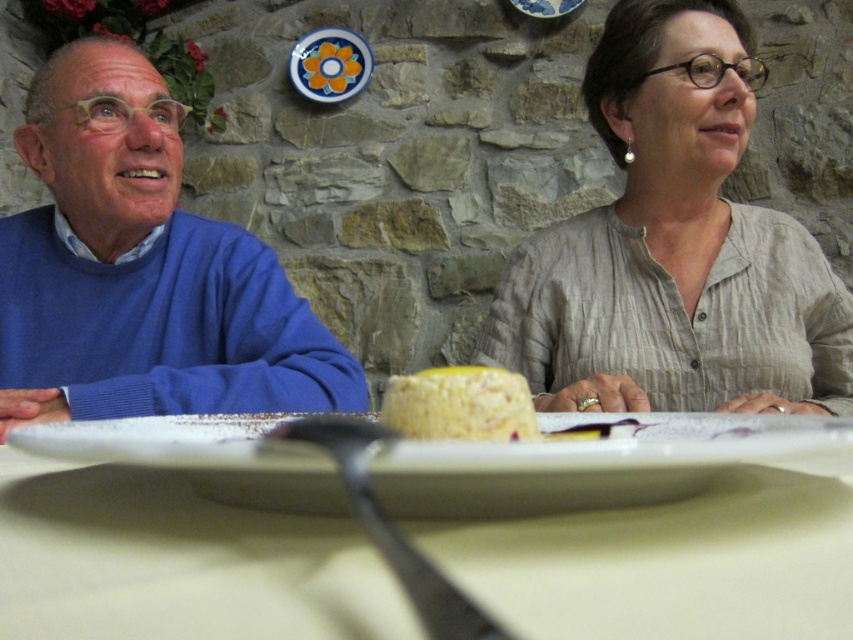
Does white matte plate at center have a smaller size compared to porcelain plate at upper center?

Actually, white matte plate at center might be larger than porcelain plate at upper center.

Who is more forward, (84,579) or (344,33)?

Point (84,579) is in front.

Is point (61, 509) closer to viewer compared to point (294, 54)?

That is True.

This screenshot has width=853, height=640. I want to click on white matte plate at center, so click(x=664, y=557).

Describe the element at coordinates (329, 65) in the screenshot. I see `porcelain plate at upper center` at that location.

Can you confirm if porcelain plate at upper center is smaller than blue glazed plate at upper center?

Incorrect, porcelain plate at upper center is not smaller in size than blue glazed plate at upper center.

Is point (312, 68) closer to camera compared to point (519, 8)?

No, it is behind (519, 8).

In order to click on porcelain plate at upper center in this screenshot , I will do `click(329, 65)`.

Is light beige linen blouse at upper right positioned at the back of white glossy plate at center?

Yes, it is behind white glossy plate at center.

Can you confirm if light beige linen blouse at upper right is bigger than white glossy plate at center?

Indeed, light beige linen blouse at upper right has a larger size compared to white glossy plate at center.

Which is in front, point (665, 339) or point (712, 435)?

Point (712, 435)

You are a GUI agent. You are given a task and a screenshot of the screen. Output one action in this format:
    pyautogui.click(x=<x>, y=<y>)
    Task: Click on the light beige linen blouse at upper right
    The width and height of the screenshot is (853, 640).
    Given the screenshot: What is the action you would take?
    pyautogui.click(x=674, y=246)